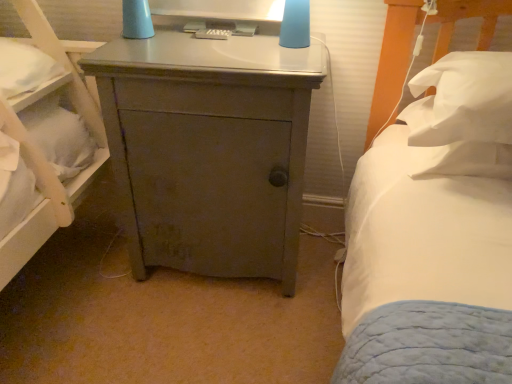
Locate an element on the screen. vacant region to the left of matte gray cabinet at center is located at coordinates (73, 276).